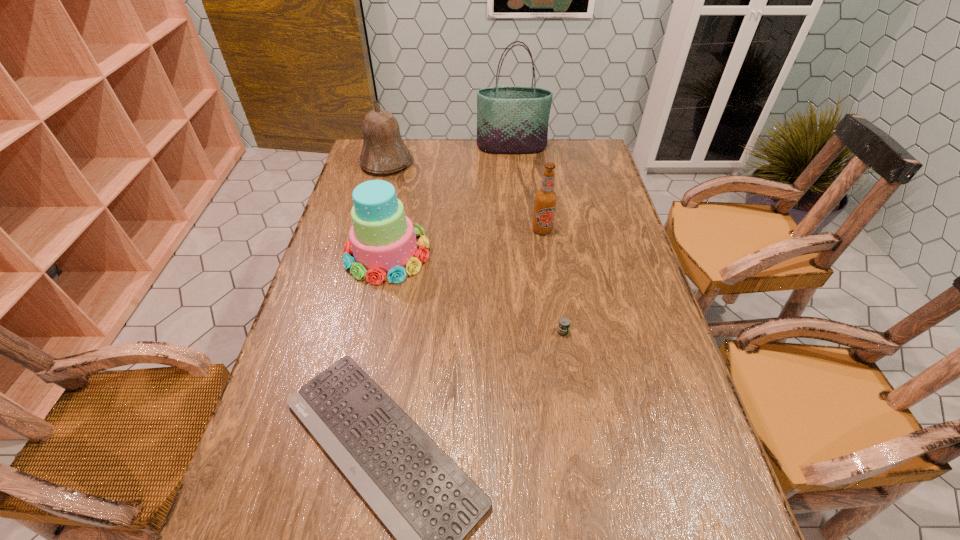
The width and height of the screenshot is (960, 540). Identify the location of vacant space that satisfies the following two spatial constraints: 1. on the back side of the cake; 2. on the right side of the tote bag. (410, 147).